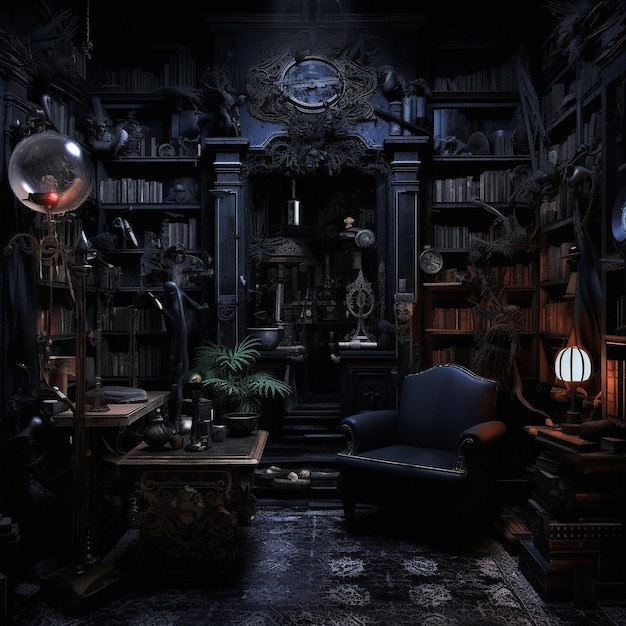
Identify the location of bowl. The width and height of the screenshot is (626, 626). 275,337.